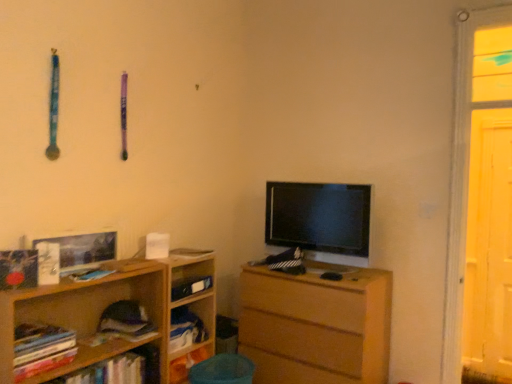
Identify the location of free space above wooden bookshelf at left, the 1th shelf when ordered from front to back (from a real-world perspective). This screenshot has width=512, height=384. (83, 271).